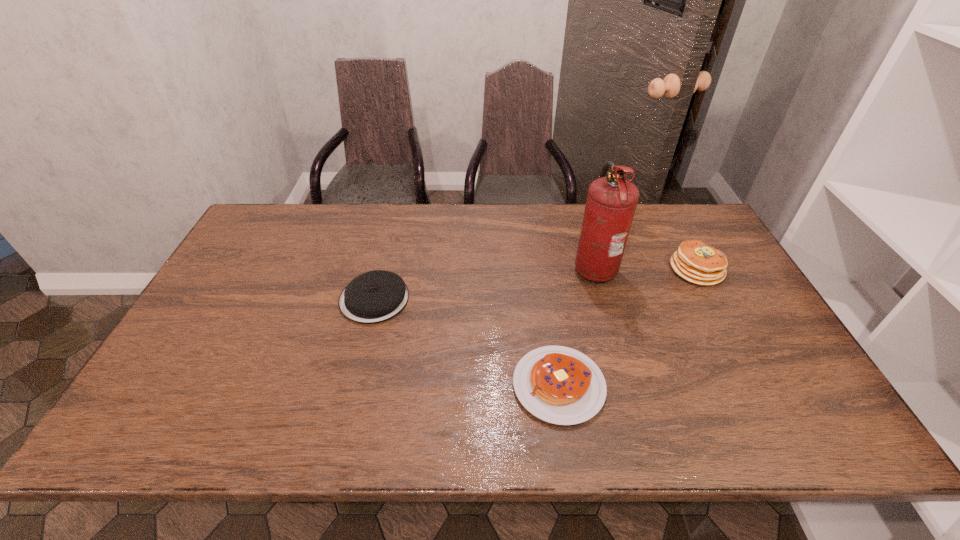
This screenshot has height=540, width=960. Find the location of `empty space that is in between the tallest object and the leftmost object`. empty space that is in between the tallest object and the leftmost object is located at coordinates (484, 282).

Point out which object is positioned as the third nearest to the rightmost pancake. Please provide its 2D coordinates. Your answer should be formatted as a tuple, i.e. [(x, y)], where the tuple contains the x and y coordinates of a point satisfying the conditions above.

[(376, 296)]

Locate an element on the screen. This screenshot has height=540, width=960. object that is the closest to the nearest object is located at coordinates (x=611, y=202).

Locate which pancake ranks in proximity to the tallest object. Please provide its 2D coordinates. Your answer should be formatted as a tuple, i.e. [(x, y)], where the tuple contains the x and y coordinates of a point satisfying the conditions above.

[(694, 261)]

Select which pancake is the second closest to the tallest pancake. Please provide its 2D coordinates. Your answer should be formatted as a tuple, i.e. [(x, y)], where the tuple contains the x and y coordinates of a point satisfying the conditions above.

[(376, 296)]

You are a GUI agent. You are given a task and a screenshot of the screen. Output one action in this format:
    pyautogui.click(x=<x>, y=<y>)
    Task: Click on the blank space that satisfies the following two spatial constraints: 1. at the front of the rightmost object where the nozzle is aimed; 2. on the right side of the tallest object
    The width and height of the screenshot is (960, 540).
    Given the screenshot: What is the action you would take?
    pyautogui.click(x=595, y=269)

Where is `vacant point that satisfies the following two spatial constraints: 1. on the front side of the leftmost object; 2. on the right side of the second pancake from right to left`? vacant point that satisfies the following two spatial constraints: 1. on the front side of the leftmost object; 2. on the right side of the second pancake from right to left is located at coordinates [x=353, y=385].

Locate an element on the screen. vacant area that satisfies the following two spatial constraints: 1. at the front of the tallest object where the nozzle is aimed; 2. on the back side of the rightmost object is located at coordinates [x=595, y=269].